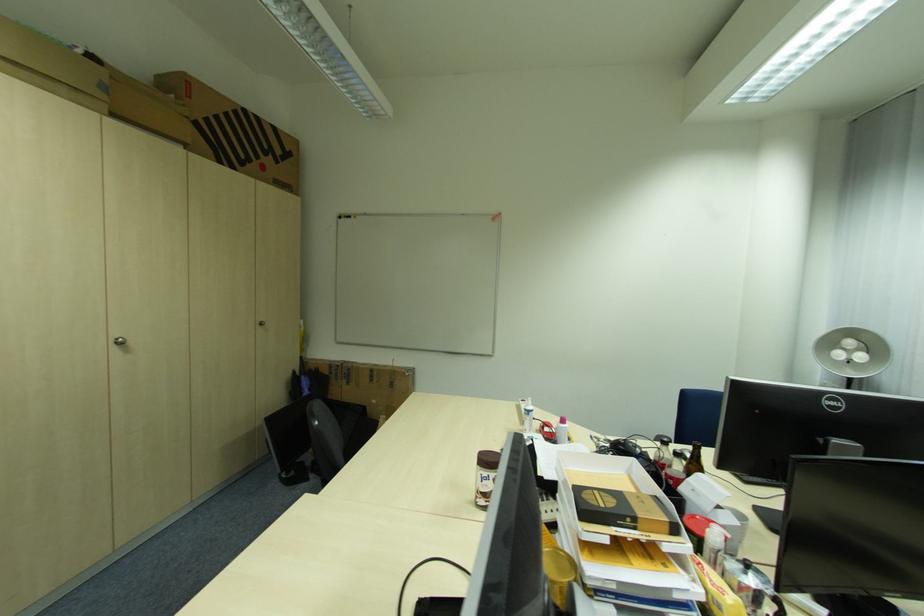
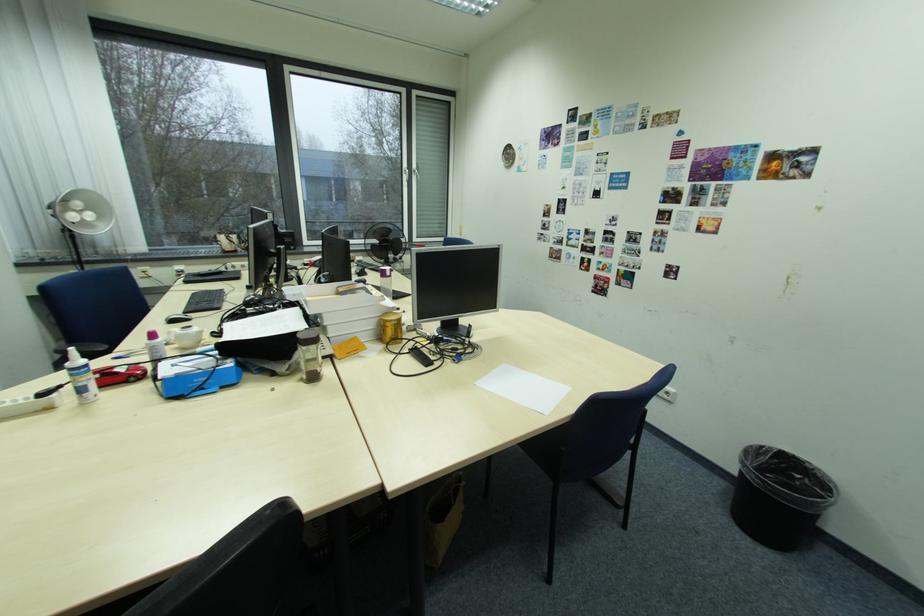
Find the pixel in the second image that matches pixel 535 413 in the first image.

(94, 370)